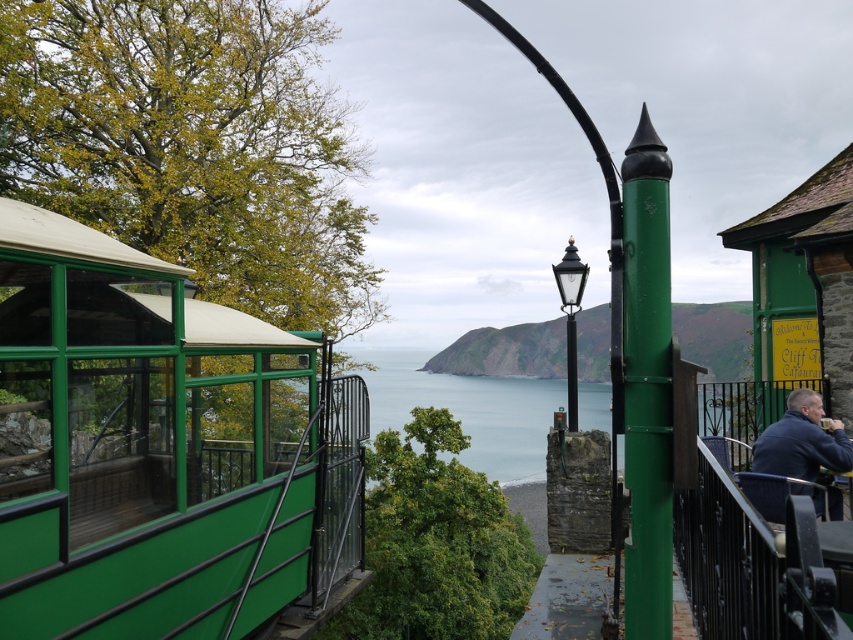
Between blue fabric jacket at right and black polished metal streetlight at center, which one has more height?

Standing taller between the two is black polished metal streetlight at center.

From the picture: Between blue fabric jacket at right and black polished metal streetlight at center, which one has less height?

blue fabric jacket at right is shorter.

Is point (834, 444) behind point (572, 259)?

No, it is not.

I want to click on blue fabric jacket at right, so click(x=801, y=442).

Is point (45, 497) positioned after point (631, 460)?

Yes, point (45, 497) is farther from viewer.

Looking at this image, is green matte/glass cable car at left to the right of green matte pole at center-right from the viewer's perspective?

In fact, green matte/glass cable car at left is to the left of green matte pole at center-right.

Measure the distance between green matte/glass cable car at left and camera.

green matte/glass cable car at left is 11.56 feet away from camera.

You are a GUI agent. You are given a task and a screenshot of the screen. Output one action in this format:
    pyautogui.click(x=<x>, y=<y>)
    Task: Click on the green matte/glass cable car at left
    
    Given the screenshot: What is the action you would take?
    pyautogui.click(x=160, y=449)

The image size is (853, 640). Describe the element at coordinates (647, 381) in the screenshot. I see `green matte pole at center-right` at that location.

Which is above, green matte pole at center-right or blue fabric jacket at right?

green matte pole at center-right is above.

Does point (671, 164) come farther from viewer compared to point (775, 454)?

That is False.

Locate an element on the screen. The height and width of the screenshot is (640, 853). green matte pole at center-right is located at coordinates (647, 381).